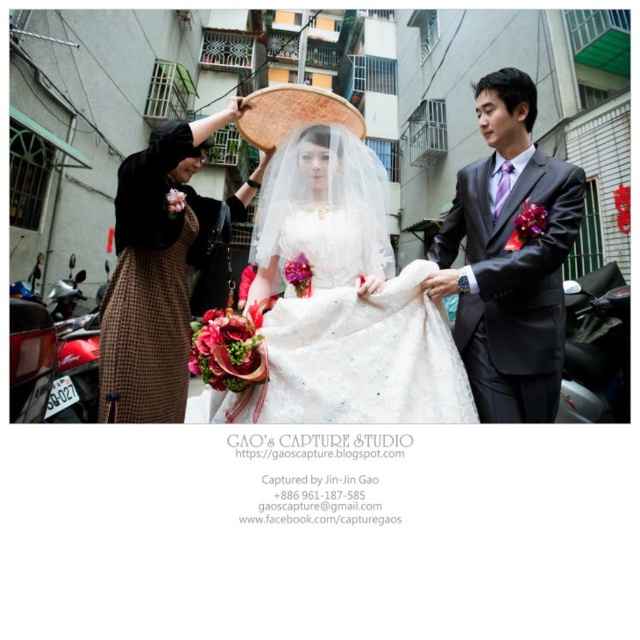
Between white lace dress at center and shiny black suit at right, which one is positioned lower?

shiny black suit at right is below.

Can you confirm if white lace dress at center is shorter than shiny black suit at right?

In fact, white lace dress at center may be taller than shiny black suit at right.

Is point (218, 406) less distant than point (486, 92)?

Yes, it is.

In order to click on white lace dress at center in this screenshot , I will do `click(330, 305)`.

Is shiny black suit at right bigger than white satin dress at center?

Incorrect, shiny black suit at right is not larger than white satin dress at center.

Does point (496, 412) come farther from viewer compared to point (179, 248)?

That is False.

The width and height of the screenshot is (640, 640). What do you see at coordinates (508, 257) in the screenshot?
I see `shiny black suit at right` at bounding box center [508, 257].

Identify the location of shiny black suit at right. The width and height of the screenshot is (640, 640). (508, 257).

Which is behind, point (525, 259) or point (125, 291)?

The point (125, 291) is more distant.

Between shiny black suit at right and brown checkered dress at left, which one has less height?

With less height is shiny black suit at right.

Identify the location of shiny black suit at right. (508, 257).

The width and height of the screenshot is (640, 640). Identify the location of shiny black suit at right. (508, 257).